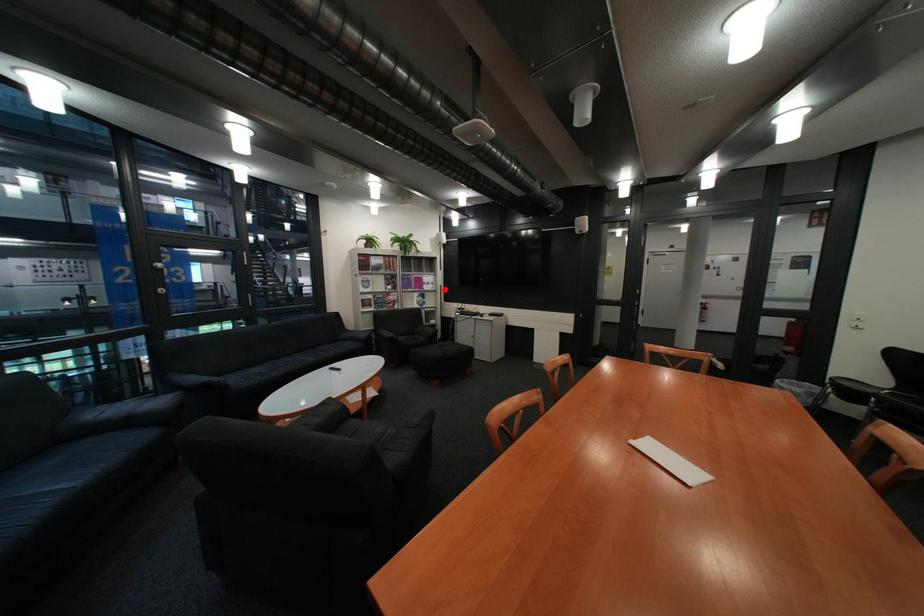
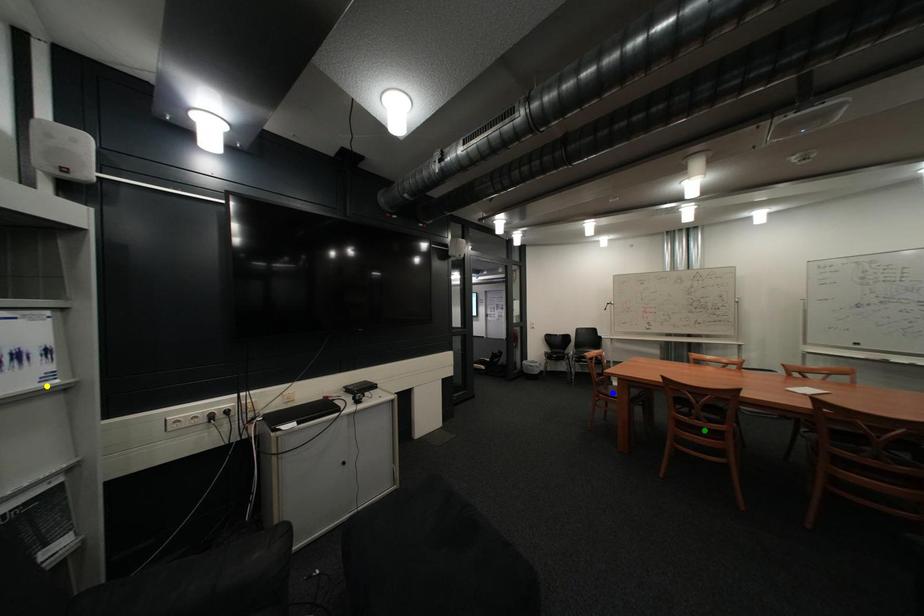
Question: I am providing you with two images of the same scene from different viewpoints. A red point is marked on the first image. You are given multiple points on the second image. Which point in image 2 is actually the same real-world point as the red point in image 1?

Choices:
 (A) yellow point
 (B) blue point
 (C) green point

Answer: (A)